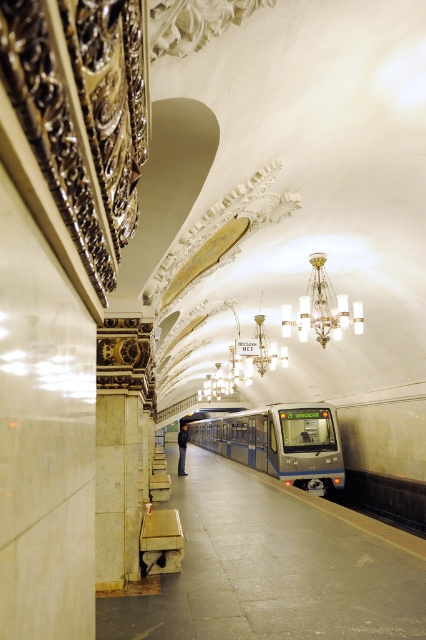
You are a passenger waiting at the subway station. You notice the blue metallic train at center and the clear glass chandelier at upper center. Which object is located higher from the ground?

The clear glass chandelier at upper center is higher from the ground than the blue metallic train at center because it is positioned above it.

You are a passenger waiting at the subway station. You notice the blue metallic train at center and the clear glass chandelier at upper center. Which object is taller?

The blue metallic train at center is taller than the clear glass chandelier at upper center according to the description.

Based on the photo, you are standing at the subway station entrance and want to board the blue metallic train at center. Based on its coordinates, in which direction should you walk to reach it?

The blue metallic train at center is located at coordinates point [279,442], so you should walk towards the center of the subway station to reach it.